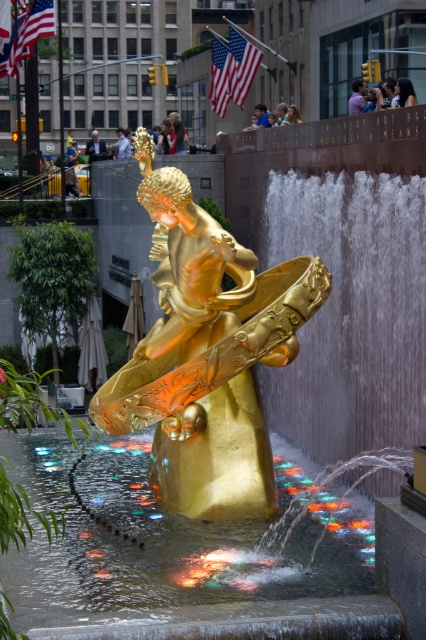
Question: Is translucent glass water at center positioned behind gold polished statue at center?

Choices:
 (A) no
 (B) yes

Answer: (A)

Question: Can you confirm if translucent glass water at center is positioned to the left of gold polished statue at center?

Choices:
 (A) no
 (B) yes

Answer: (B)

Question: Can you confirm if translucent glass water at center is positioned above gold polished statue at center?

Choices:
 (A) yes
 (B) no

Answer: (B)

Question: Among these points, which one is farthest from the camera?

Choices:
 (A) (279, 618)
 (B) (215, 336)

Answer: (B)

Question: Which point is farther to the camera?

Choices:
 (A) translucent glass water at center
 (B) gold polished statue at center

Answer: (B)